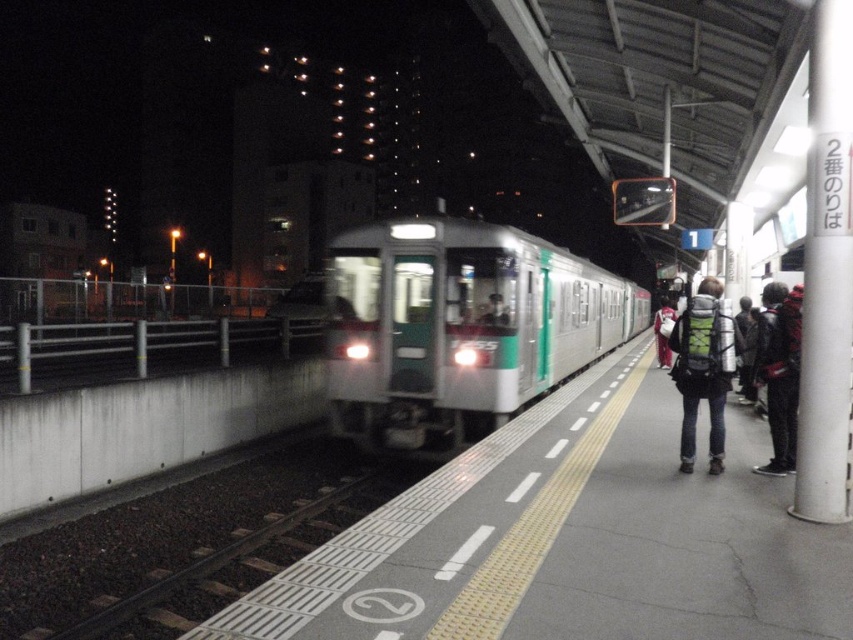
Question: Which of these objects is positioned farthest from the green metallic train at center?

Choices:
 (A) green backpack at center
 (B) red backpack at right

Answer: (B)

Question: Which of these objects is positioned closest to the green metallic train at center?

Choices:
 (A) red backpack at right
 (B) green backpack at center

Answer: (B)

Question: Which point is closer to the camera taking this photo?

Choices:
 (A) (712, 419)
 (B) (613, 282)

Answer: (A)

Question: Is green metallic train at center closer to camera compared to red backpack at right?

Choices:
 (A) yes
 (B) no

Answer: (B)

Question: Can you confirm if green metallic train at center is bigger than red backpack at right?

Choices:
 (A) no
 (B) yes

Answer: (B)

Question: Is green metallic train at center thinner than red backpack at right?

Choices:
 (A) yes
 (B) no

Answer: (B)